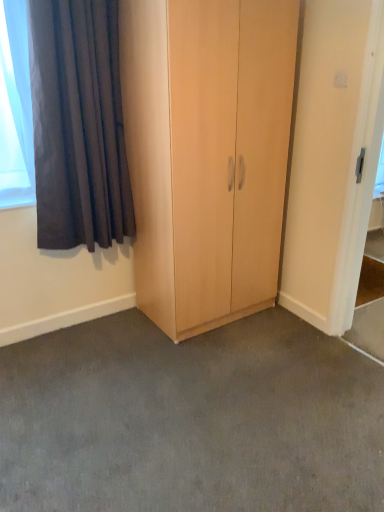
Where is `free space in front of light wood cupboard at center`? This screenshot has height=512, width=384. free space in front of light wood cupboard at center is located at coordinates (215, 368).